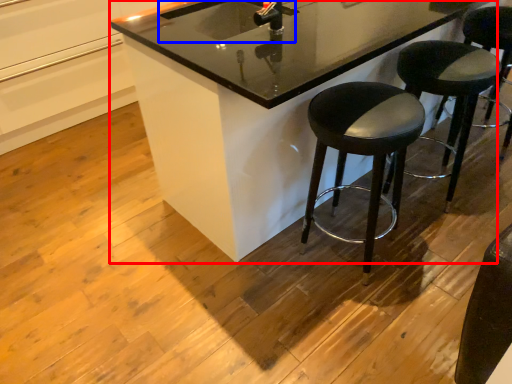
Question: Among these objects, which one is nearest to the camera, counter (highlighted by a red box) or sink (highlighted by a blue box)?

Choices:
 (A) counter
 (B) sink

Answer: (A)